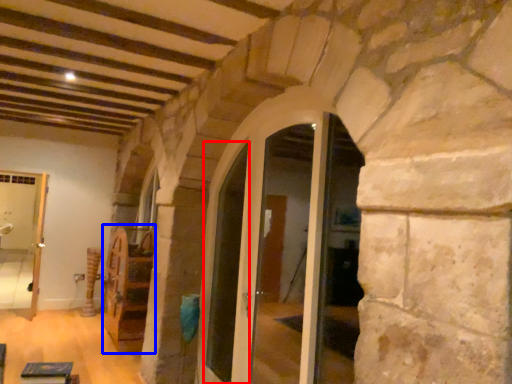
Question: Among these objects, which one is farthest to the camera, door (highlighted by a red box) or furniture (highlighted by a blue box)?

Choices:
 (A) door
 (B) furniture

Answer: (B)